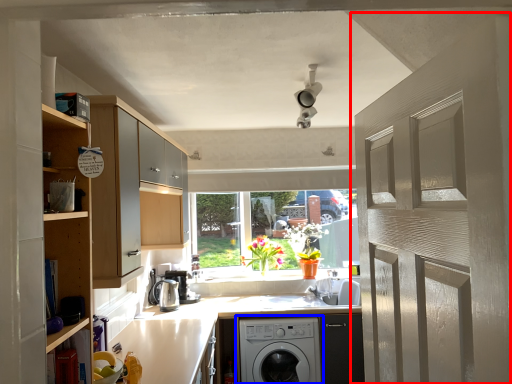
Question: Which of the following is the farthest to the observer, door (highlighted by a red box) or washing machine (highlighted by a blue box)?

Choices:
 (A) door
 (B) washing machine

Answer: (B)